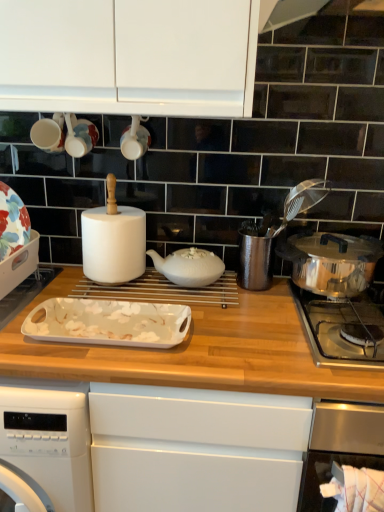
Question: From a real-world perspective, is white glossy tray at left, acting as the first kitchen appliance starting from the left, located beneath polished stainless steel pot at right?

Choices:
 (A) no
 (B) yes

Answer: (A)

Question: From the image's perspective, does white glossy tray at left, the 3th kitchen appliance in the right-to-left sequence, appear higher than polished stainless steel pot at right?

Choices:
 (A) yes
 (B) no

Answer: (A)

Question: From the image's perspective, is white glossy tray at left, the 3th kitchen appliance in the right-to-left sequence, under polished stainless steel pot at right?

Choices:
 (A) no
 (B) yes

Answer: (A)

Question: Can you confirm if white glossy tray at left, the 3th kitchen appliance in the right-to-left sequence, is shorter than polished stainless steel pot at right?

Choices:
 (A) no
 (B) yes

Answer: (A)

Question: Can you confirm if white glossy tray at left, acting as the first kitchen appliance starting from the left, is thinner than polished stainless steel pot at right?

Choices:
 (A) no
 (B) yes

Answer: (B)

Question: Can you confirm if white glossy tray at left, the 3th kitchen appliance in the right-to-left sequence, is wider than polished stainless steel pot at right?

Choices:
 (A) yes
 (B) no

Answer: (B)

Question: From the image's perspective, is white glossy tray at center, arranged as the 2th kitchen appliance when viewed from the left, beneath polished stainless steel pot at right?

Choices:
 (A) yes
 (B) no

Answer: (B)

Question: Would you consider white glossy tray at center, arranged as the 2th kitchen appliance when viewed from the left, to be distant from polished stainless steel pot at right?

Choices:
 (A) yes
 (B) no

Answer: (B)

Question: Is white glossy tray at center, arranged as the 2th kitchen appliance when viewed from the left, next to polished stainless steel pot at right?

Choices:
 (A) no
 (B) yes

Answer: (A)

Question: From the image's perspective, is white glossy tray at center, arranged as the 2th kitchen appliance when viewed from the left, on top of polished stainless steel pot at right?

Choices:
 (A) no
 (B) yes

Answer: (B)

Question: Can you confirm if white glossy tray at center, which is the second kitchen appliance in right-to-left order, is positioned to the left of polished stainless steel pot at right?

Choices:
 (A) yes
 (B) no

Answer: (A)

Question: Is white glossy tray at center, arranged as the 2th kitchen appliance when viewed from the left, further to camera compared to polished stainless steel pot at right?

Choices:
 (A) yes
 (B) no

Answer: (A)

Question: Does polished stainless steel pot at right, arranged as the first kitchen appliance when viewed from the right, turn towards polished stainless steel pot at right?

Choices:
 (A) yes
 (B) no

Answer: (B)